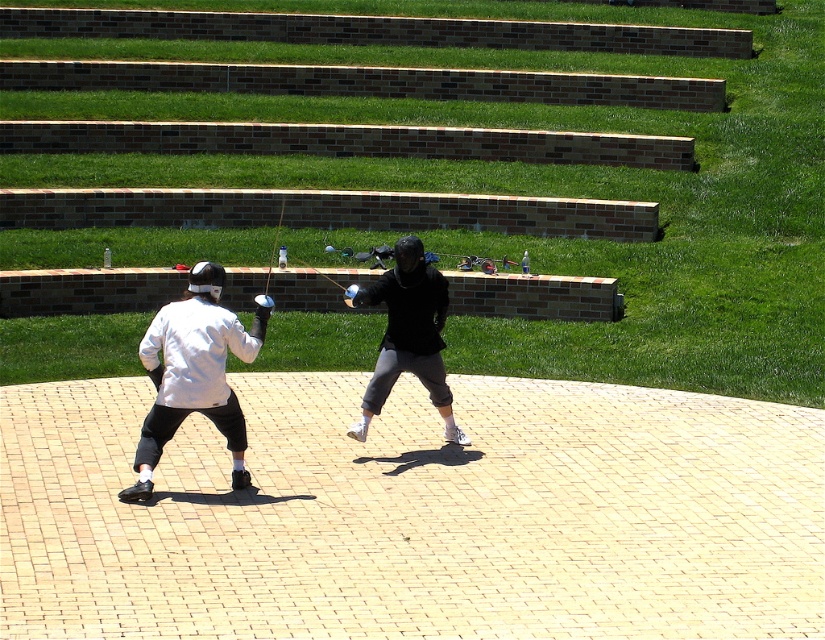
You are a photographer trying to capture a closeup of both the white matte jacket at center and the black matte jacket at center. Since you want to focus on their sizes, which jacket should you zoom in on more to make them appear similar in size in the photo?

The white matte jacket at center is smaller than the black matte jacket at center. To make them appear similar in size in the photo, you should zoom in more on the white matte jacket at center so that its image is magnified to match the size of the black matte jacket at center.

You are a photographer setting up for a fencing match photo shoot. You need to ensure that both fencers are visible in the frame. Given that the white matte jacket at center and the black matte jacket at center are of different widths, which jacket will require more space in the frame horizontally?

The white matte jacket at center has a larger width than the black matte jacket at center, so it will require more horizontal space in the frame.

You are a photographer trying to capture a photo of both the white matte fencing gear at center and the black matte jacket at center. Since you want to ensure both are fully visible in the frame, which object should you focus on first to account for their sizes?

The white matte fencing gear at center is much taller than the black matte jacket at center, so you should focus on the white matte fencing gear at center first to ensure it fits properly in the frame before adjusting for the smaller black matte jacket at center.